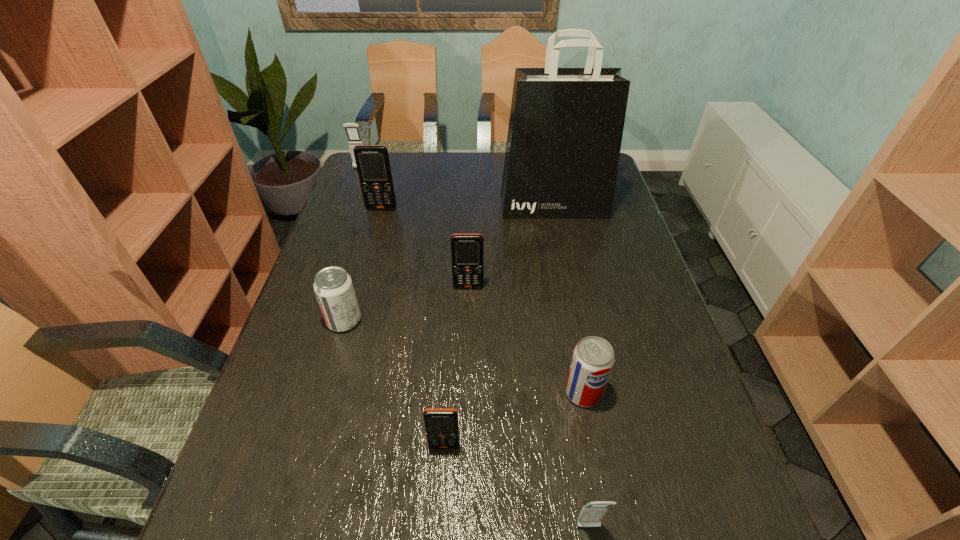
Identify the location of vacant area located on the back of the right soda can. Image resolution: width=960 pixels, height=540 pixels. (568, 315).

You are a GUI agent. You are given a task and a screenshot of the screen. Output one action in this format:
    pyautogui.click(x=<x>, y=<y>)
    Task: Click on the free space located on the right of the farther soda can
    This screenshot has width=960, height=540.
    Given the screenshot: What is the action you would take?
    pyautogui.click(x=401, y=320)

This screenshot has width=960, height=540. What are the coordinates of `object that is at the far edge` in the screenshot? It's located at (352, 130).

Where is `object positioned at the near edge`? object positioned at the near edge is located at coordinates (592, 513).

Where is `soda can that is at the left edge`? soda can that is at the left edge is located at coordinates (333, 287).

The image size is (960, 540). In order to click on object that is at the right edge in this screenshot , I will do `click(565, 131)`.

Locate an element on the screen. object that is positioned at the far left corner is located at coordinates click(352, 130).

At what (x,y) coordinates should I click in order to perform the action: click on free region at the far edge of the desktop. Please return your answer as a coordinate pair (x, y). The height and width of the screenshot is (540, 960). Looking at the image, I should click on (488, 177).

The image size is (960, 540). I want to click on free space at the left edge of the desktop, so click(x=361, y=238).

Locate an element on the screen. The width and height of the screenshot is (960, 540). free space at the right edge of the desktop is located at coordinates (590, 244).